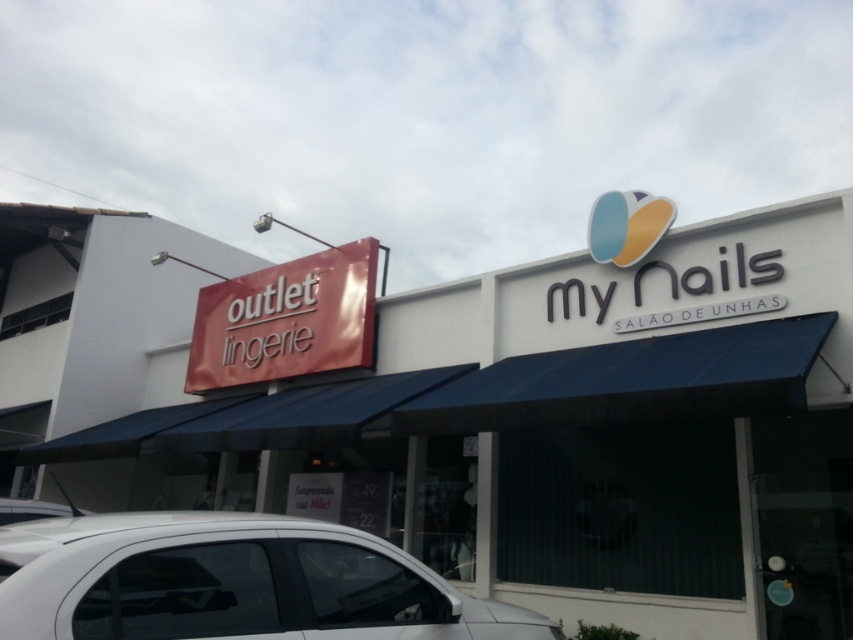
You are a customer looking for the entrance to the store with the white glossy car at lower left. Based on the scene, where should you look relative to the white matte sign at upper center?

The white glossy car at lower left is positioned below the white matte sign at upper center, so you should look downward from the white matte sign at upper center to find the entrance to the store with the white glossy car at lower left.

What is the color of the sign located at point (468, 406) in the image?

The point (468, 406) corresponds to the white matte sign at upper center, so the color is white.

You are a customer looking for the nail salon. You see the white matte sign at upper center and the white matte car at lower left. Which object is located higher up in the image?

The white matte sign at upper center is positioned over the white matte car at lower left, so it is higher up in the image.